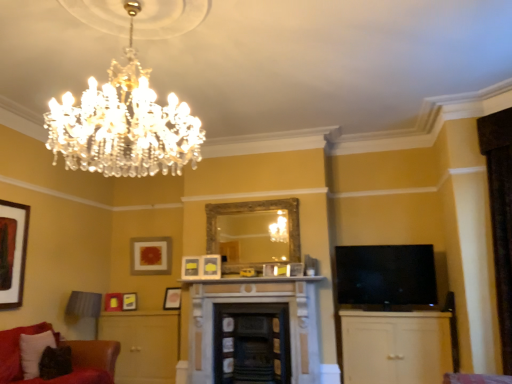
Question: Would you say velvet red couch at lower left is outside white marble fireplace at center?

Choices:
 (A) no
 (B) yes

Answer: (B)

Question: Does velvet red couch at lower left have a lesser width compared to white marble fireplace at center?

Choices:
 (A) no
 (B) yes

Answer: (A)

Question: Does velvet red couch at lower left turn towards white marble fireplace at center?

Choices:
 (A) no
 (B) yes

Answer: (A)

Question: Is velvet red couch at lower left wider than white marble fireplace at center?

Choices:
 (A) no
 (B) yes

Answer: (B)

Question: Does velvet red couch at lower left have a greater height compared to white marble fireplace at center?

Choices:
 (A) no
 (B) yes

Answer: (B)

Question: Is point (293, 269) positioned closer to the camera than point (287, 281)?

Choices:
 (A) farther
 (B) closer

Answer: (A)

Question: From the image's perspective, is matte white picture frame at center, which is the first picture frame in right-to-left order, located above or below white marble fireplace at center?

Choices:
 (A) above
 (B) below

Answer: (A)

Question: Choose the correct answer: Is matte white picture frame at center, which is the first picture frame in right-to-left order, inside white marble fireplace at center or outside it?

Choices:
 (A) outside
 (B) inside

Answer: (A)

Question: Considering their positions, is matte white picture frame at center, which is the first picture frame in right-to-left order, located in front of or behind white marble fireplace at center?

Choices:
 (A) behind
 (B) front

Answer: (A)

Question: Relative to matte gold picture frame at lower left, the seventh picture frame positioned from the front, is matte yellow picture frame at lower left, acting as the sixth picture frame starting from the right, in front or behind?

Choices:
 (A) behind
 (B) front

Answer: (B)

Question: Does point (135, 301) appear closer or farther from the camera than point (117, 294)?

Choices:
 (A) closer
 (B) farther

Answer: (B)

Question: From a real-world perspective, is matte yellow picture frame at lower left, which appears as the 3th picture frame when viewed from the back, above or below matte gold picture frame at lower left, which is counted as the second picture frame, starting from the left?

Choices:
 (A) below
 (B) above

Answer: (B)

Question: Do you think matte yellow picture frame at lower left, acting as the sixth picture frame starting from the right, is within matte gold picture frame at lower left, which is counted as the 2th picture frame, starting from the back, or outside of it?

Choices:
 (A) outside
 (B) inside

Answer: (A)

Question: Visually, is white marble fireplace at center positioned to the left or to the right of black glossy tv at right?

Choices:
 (A) left
 (B) right

Answer: (A)

Question: Do you think white marble fireplace at center is within black glossy tv at right, or outside of it?

Choices:
 (A) inside
 (B) outside

Answer: (B)